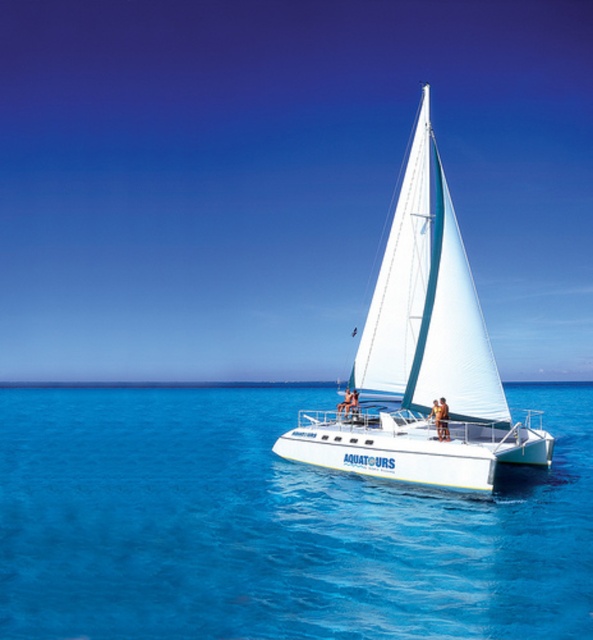
Question: Is blue liquid water at center to the left of white matte sailboat at center from the viewer's perspective?

Choices:
 (A) no
 (B) yes

Answer: (A)

Question: From the image, what is the correct spatial relationship of blue liquid water at center in relation to white matte sailboat at center?

Choices:
 (A) right
 (B) left

Answer: (A)

Question: Which object appears farthest from the camera in this image?

Choices:
 (A) blue liquid water at center
 (B) white matte sailboat at center

Answer: (B)

Question: Can you confirm if blue liquid water at center is positioned above white matte sailboat at center?

Choices:
 (A) yes
 (B) no

Answer: (B)